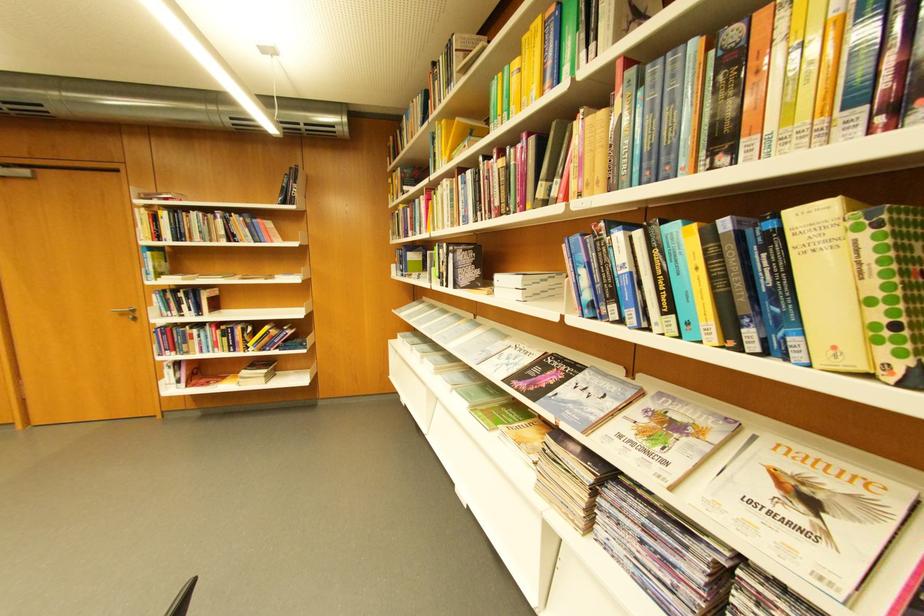
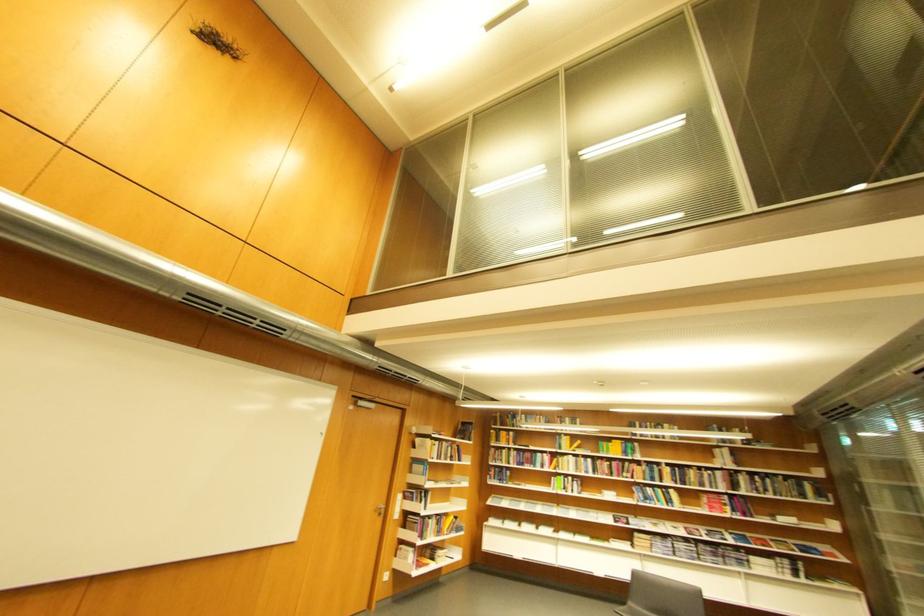
The point at (239, 241) is marked in the first image. Where is the corresponding point in the second image?

(460, 461)